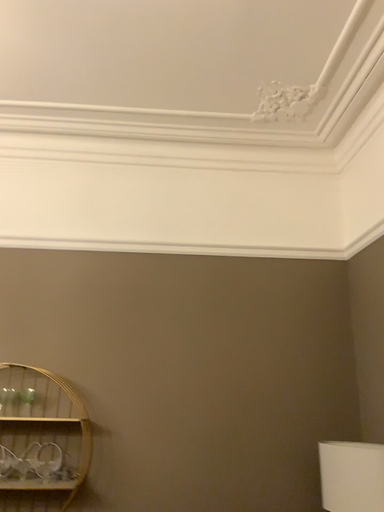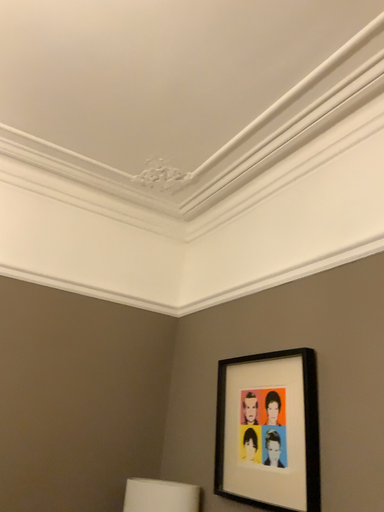
Question: How did the camera likely rotate when shooting the video?

Choices:
 (A) rotated right
 (B) rotated left

Answer: (A)